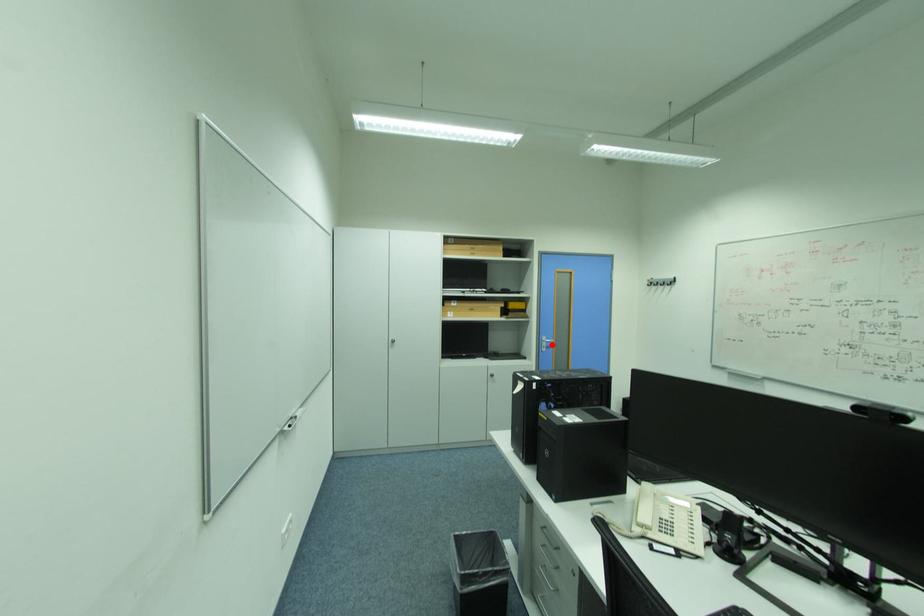
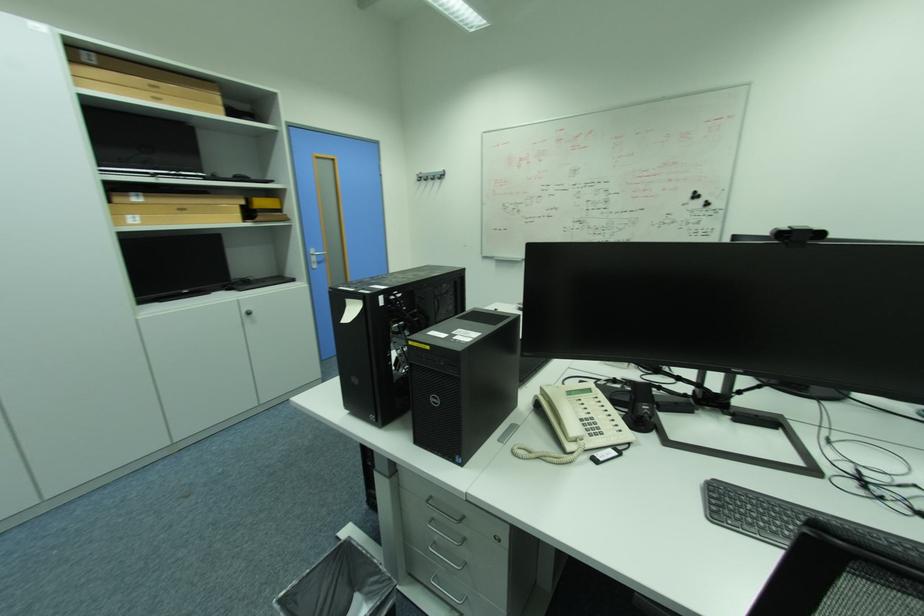
In the second image, find the point that corresponds to the highlighted location in the first image.

(321, 260)